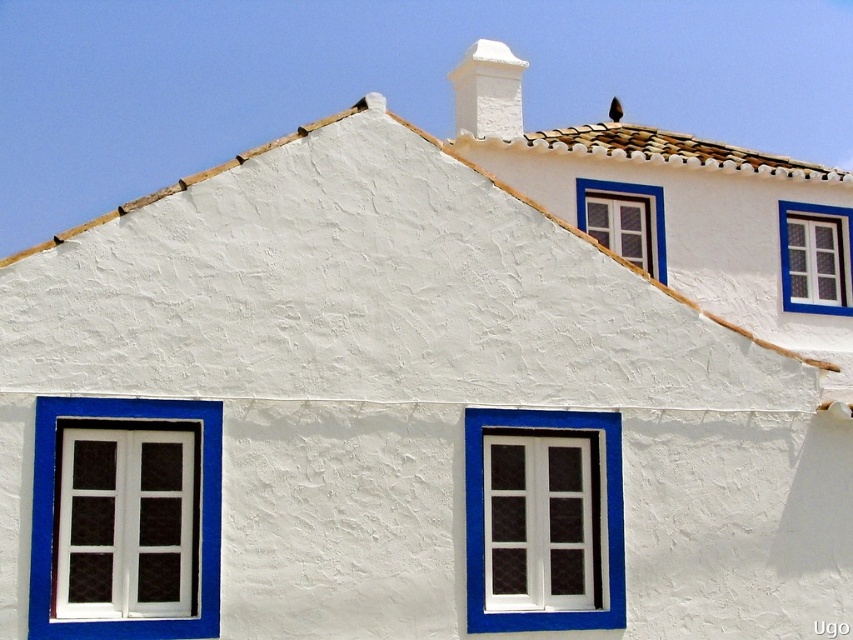
Question: Which point is farther to the camera?

Choices:
 (A) brown clay tiles at upper center
 (B) white painted wood window at center

Answer: (A)

Question: Considering the relative positions of white stucco chimney at upper center and white painted wood window at upper center in the image provided, where is white stucco chimney at upper center located with respect to white painted wood window at upper center?

Choices:
 (A) below
 (B) above

Answer: (B)

Question: Which point appears farthest from the camera in this image?

Choices:
 (A) (782, 284)
 (B) (630, 150)
 (C) (466, 627)
 (D) (577, 209)

Answer: (A)

Question: Is white painted wood window at lower left below white painted wood window at upper center?

Choices:
 (A) no
 (B) yes

Answer: (B)

Question: Is the position of white painted wood window at center less distant than that of white painted wood window at upper right?

Choices:
 (A) yes
 (B) no

Answer: (A)

Question: Which object is farther from the camera taking this photo?

Choices:
 (A) white painted wood window at upper right
 (B) brown clay tiles at upper center
 (C) white painted wood window at upper center
 (D) white stucco chimney at upper center

Answer: (A)